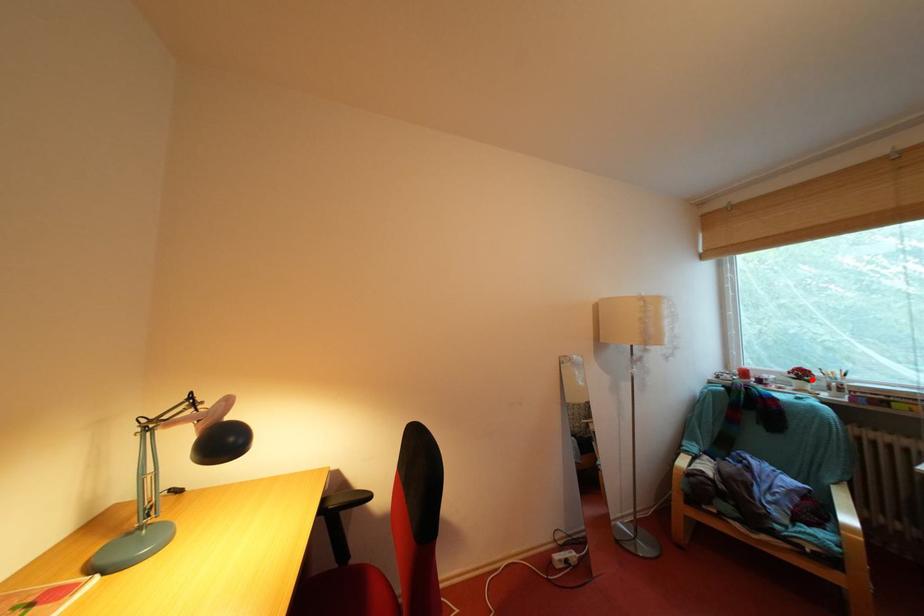
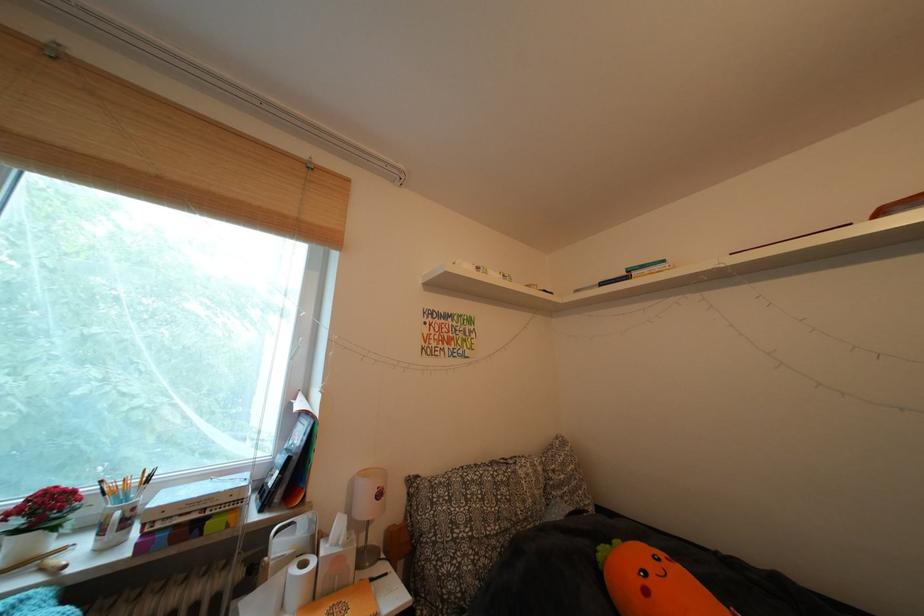
Where in the second image is the point corresponding to the highlighted location from the first image?

(56, 513)